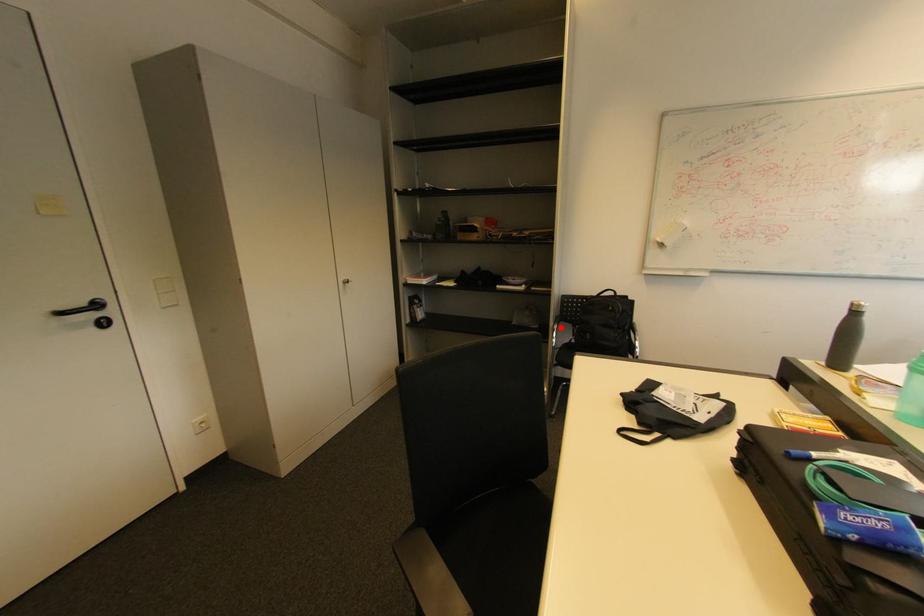
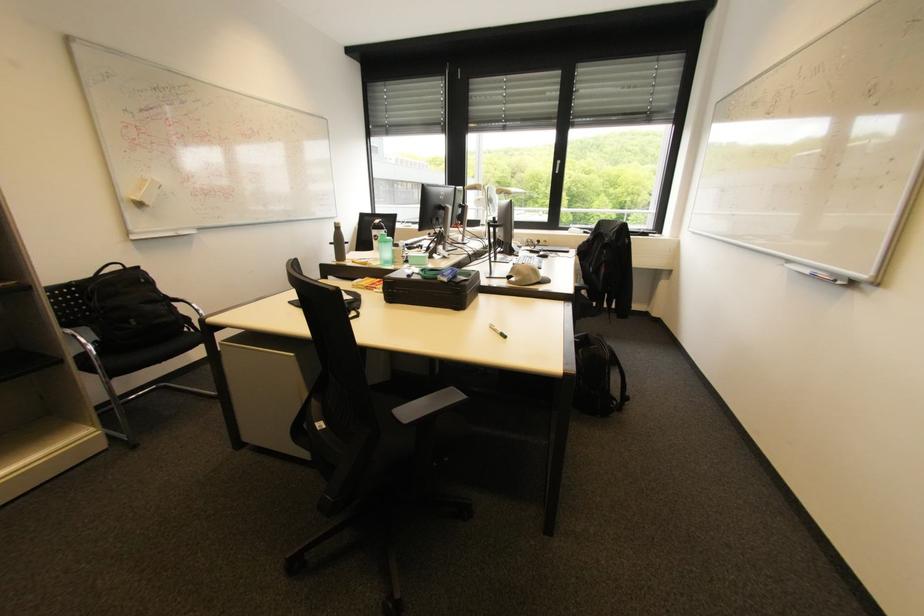
In the second image, find the point that corresponds to the highlighted location in the first image.

(74, 331)